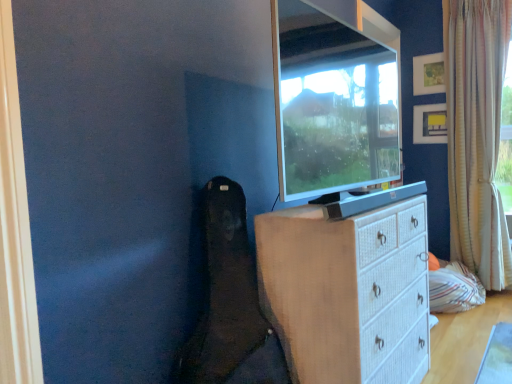
Question: Does point (434, 87) appear closer or farther from the camera than point (492, 130)?

Choices:
 (A) closer
 (B) farther

Answer: (B)

Question: From the image's perspective, is matte white picture frame at upper right, positioned as the first picture frame in top-to-bottom order, located above or below white textured curtain at right?

Choices:
 (A) below
 (B) above

Answer: (B)

Question: Based on their relative distances, which object is nearer to the matte yellow picture frame at upper right, which appears as the 2th picture frame when viewed from the top?

Choices:
 (A) white wicker chest of drawers at center
 (B) matte white picture frame at upper right, positioned as the first picture frame in top-to-bottom order
 (C) matte black tv at upper center
 (D) white textured curtain at right

Answer: (B)

Question: Estimate the real-world distances between objects in this image. Which object is farther from the matte white picture frame at upper right, positioned as the first picture frame in top-to-bottom order?

Choices:
 (A) matte black tv at upper center
 (B) white textured curtain at right
 (C) matte yellow picture frame at upper right, the first picture frame in the bottom-to-top sequence
 (D) white wicker chest of drawers at center

Answer: (D)